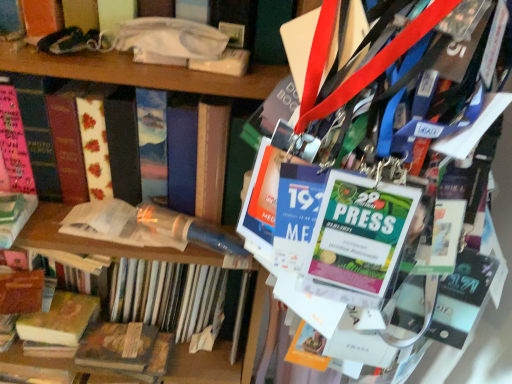
Question: Which direction should I rotate to face translucent plastic tube at center, which is counted as the 3th book, starting from the bottom, — up or down?

Choices:
 (A) up
 (B) down

Answer: (B)

Question: Can we say wooden book at lower left, the fourth book when ordered from top to bottom, lies outside translucent plastic tube at center, which is counted as the 3th book, starting from the bottom?

Choices:
 (A) no
 (B) yes

Answer: (B)

Question: Is wooden book at lower left, which is the 1th book in bottom-to-top order, positioned behind translucent plastic tube at center, the second book in the top-to-bottom sequence?

Choices:
 (A) no
 (B) yes

Answer: (B)

Question: Can you confirm if wooden book at lower left, the fourth book when ordered from top to bottom, is positioned to the left of translucent plastic tube at center, the second book in the top-to-bottom sequence?

Choices:
 (A) yes
 (B) no

Answer: (A)

Question: From the image's perspective, does wooden book at lower left, which is the 1th book in bottom-to-top order, appear lower than translucent plastic tube at center, the second book in the top-to-bottom sequence?

Choices:
 (A) yes
 (B) no

Answer: (A)

Question: Does wooden book at lower left, the fourth book when ordered from top to bottom, have a greater height compared to translucent plastic tube at center, the second book in the top-to-bottom sequence?

Choices:
 (A) no
 (B) yes

Answer: (A)

Question: Does wooden book at lower left, which is the 1th book in bottom-to-top order, turn towards translucent plastic tube at center, the second book in the top-to-bottom sequence?

Choices:
 (A) no
 (B) yes

Answer: (A)

Question: Is translucent plastic tube at center, the second book in the top-to-bottom sequence, facing towards wooden book at lower left, which is the 1th book in bottom-to-top order?

Choices:
 (A) no
 (B) yes

Answer: (B)

Question: Can you confirm if translucent plastic tube at center, the second book in the top-to-bottom sequence, is bigger than wooden book at lower left, the fourth book when ordered from top to bottom?

Choices:
 (A) no
 (B) yes

Answer: (B)

Question: Is translucent plastic tube at center, which is counted as the 3th book, starting from the bottom, to the left of wooden book at lower left, which is the 1th book in bottom-to-top order, from the viewer's perspective?

Choices:
 (A) no
 (B) yes

Answer: (A)

Question: Considering the relative sizes of translucent plastic tube at center, the second book in the top-to-bottom sequence, and wooden book at lower left, which is the 1th book in bottom-to-top order, in the image provided, is translucent plastic tube at center, the second book in the top-to-bottom sequence, wider than wooden book at lower left, which is the 1th book in bottom-to-top order,?

Choices:
 (A) yes
 (B) no

Answer: (A)

Question: Is the depth of translucent plastic tube at center, which is counted as the 3th book, starting from the bottom, greater than that of wooden book at lower left, which is the 1th book in bottom-to-top order?

Choices:
 (A) yes
 (B) no

Answer: (B)

Question: Considering the relative sizes of translucent plastic tube at center, which is counted as the 3th book, starting from the bottom, and wooden book at lower left, the fourth book when ordered from top to bottom, in the image provided, is translucent plastic tube at center, which is counted as the 3th book, starting from the bottom, thinner than wooden book at lower left, the fourth book when ordered from top to bottom,?

Choices:
 (A) yes
 (B) no

Answer: (B)

Question: Is translucent plastic tube at center, which is counted as the 3th book, starting from the bottom, next to yellow paperback book at lower left, which ranks as the 2th book in bottom-to-top order?

Choices:
 (A) yes
 (B) no

Answer: (B)